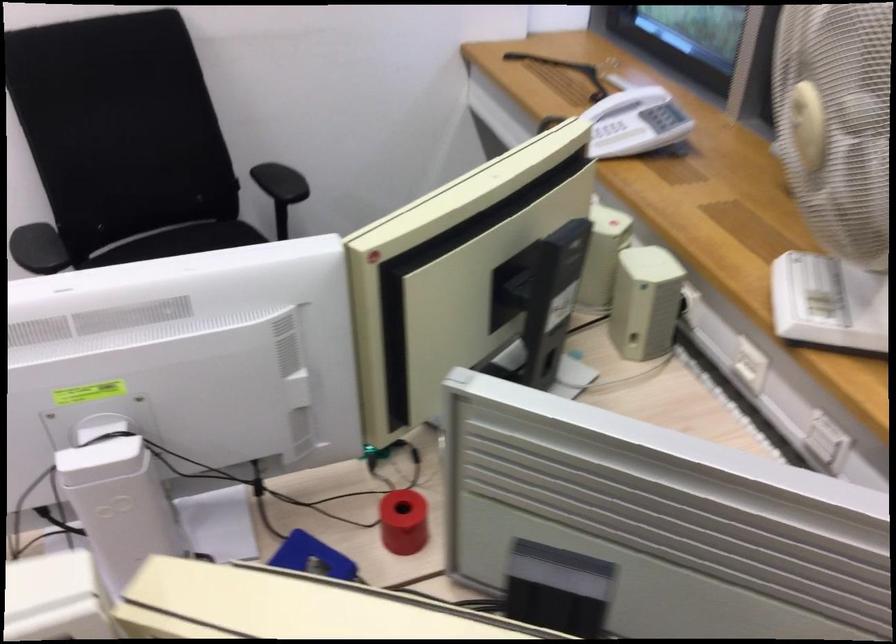
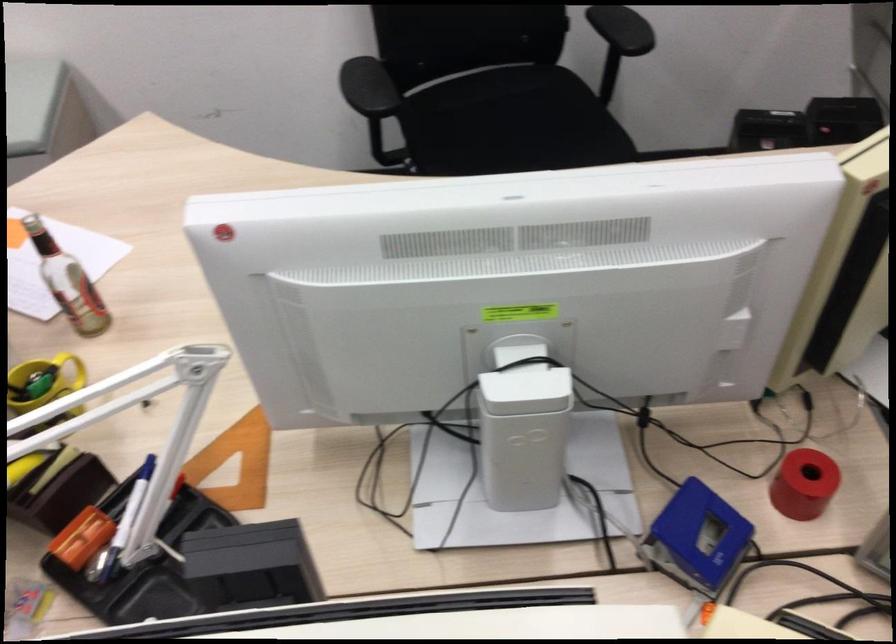
Question: Based on the continuous images, in which direction is the camera rotating? Reply with the corresponding letter.

Choices:
 (A) Left
 (B) Right
 (C) Up
 (D) Down

Answer: (D)